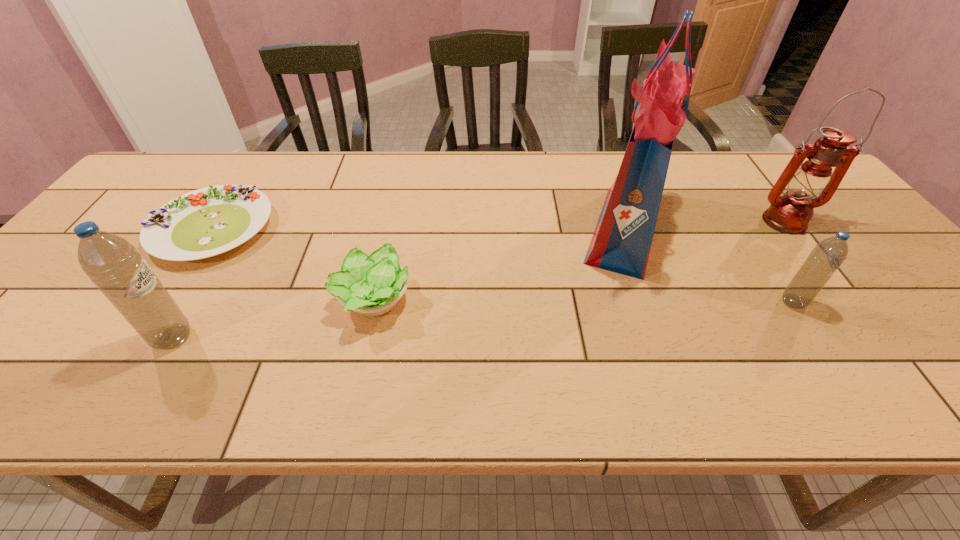
In order to click on salad plate located in the far edge section of the desktop in this screenshot , I will do (x=206, y=222).

This screenshot has height=540, width=960. Identify the location of water bottle present at the near edge. (113, 264).

Locate an element on the screen. The width and height of the screenshot is (960, 540). lettuce positioned at the near edge is located at coordinates (372, 285).

At what (x,y) coordinates should I click in order to perform the action: click on object located at the left edge. Please return your answer as a coordinate pair (x, y). Image resolution: width=960 pixels, height=540 pixels. Looking at the image, I should click on (206, 222).

I want to click on object situated at the right edge, so click(790, 213).

Identify the location of object present at the far left corner. This screenshot has height=540, width=960. (206, 222).

The width and height of the screenshot is (960, 540). Find the location of `vacant area at the far edge`. vacant area at the far edge is located at coordinates (333, 156).

Identify the location of free space at the near edge. (839, 348).

At what (x,y) coordinates should I click in order to perform the action: click on free space at the left edge of the desktop. Please return your answer as a coordinate pair (x, y). This screenshot has width=960, height=540. Looking at the image, I should click on (23, 315).

I want to click on free space at the right edge, so pos(914,296).